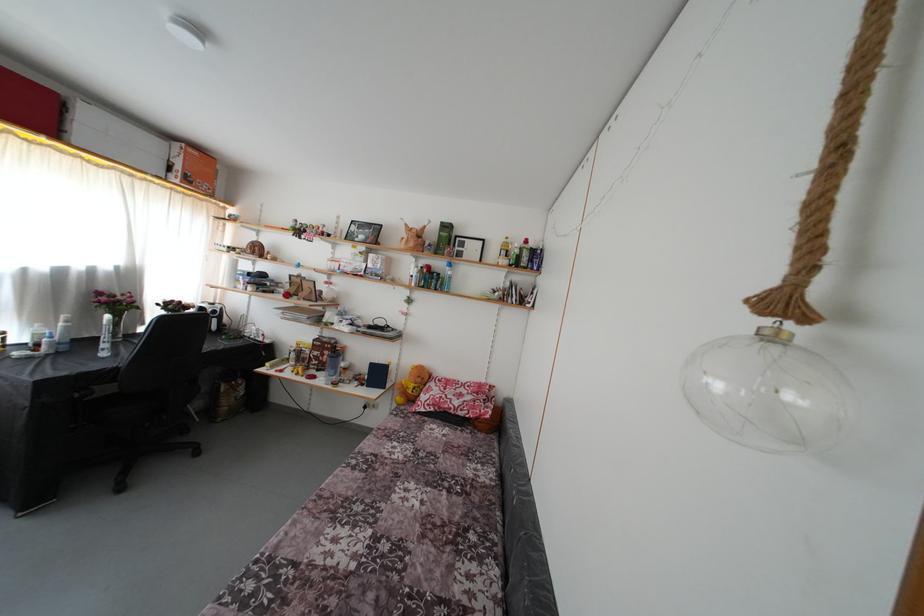
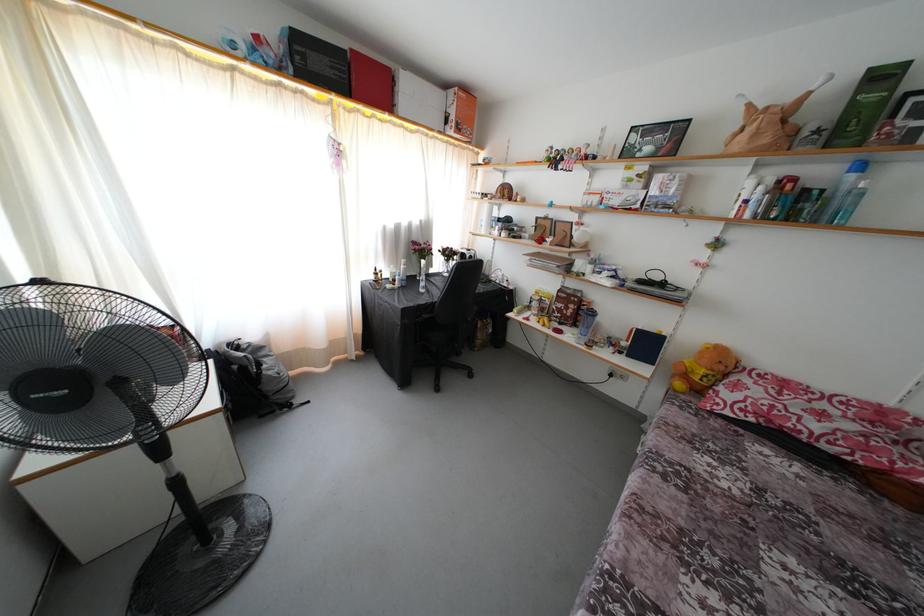
Find the pixel in the second image that matches point 451,270 in the first image.

(849, 172)